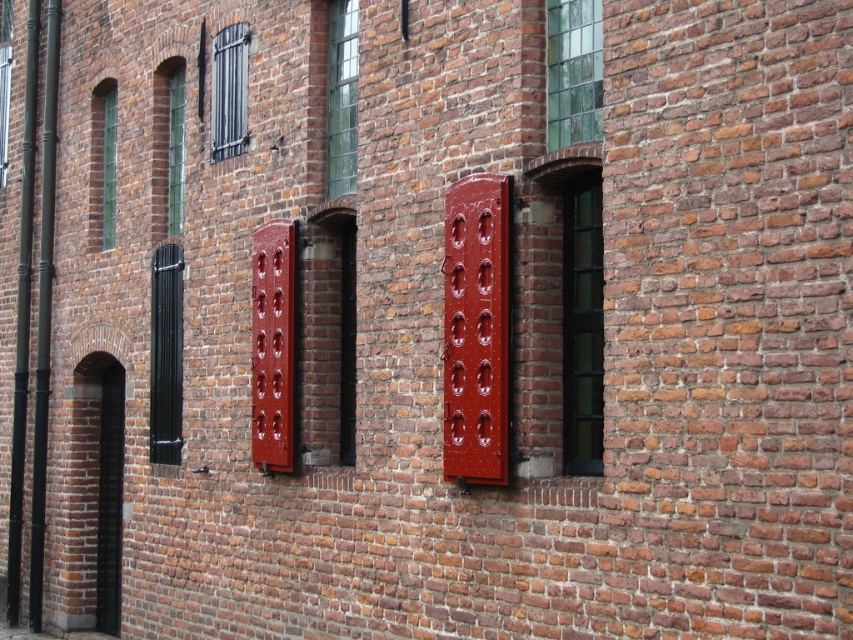
Question: Can you confirm if clear glass window at center right is thinner than matte black shutters at upper left?

Choices:
 (A) yes
 (B) no

Answer: (A)

Question: Is clear glass window at upper right positioned before matte black shutter at left?

Choices:
 (A) yes
 (B) no

Answer: (A)

Question: Which of the following is the farthest from the observer?

Choices:
 (A) (340, 170)
 (B) (572, 115)
 (C) (590, 440)
 (D) (105, 90)

Answer: (D)

Question: Observing the image, what is the correct spatial positioning of matte black shutters at upper left in reference to green stained glass window at upper left?

Choices:
 (A) above
 (B) below

Answer: (A)

Question: Which point appears closest to the camera in this image?

Choices:
 (A) (239, 77)
 (B) (109, 129)
 (C) (566, 376)
 (D) (599, 132)

Answer: (D)

Question: Which object appears closest to the camera in this image?

Choices:
 (A) clear glass window at center right
 (B) clear glass window at upper right
 (C) green stained glass window at upper left

Answer: (B)